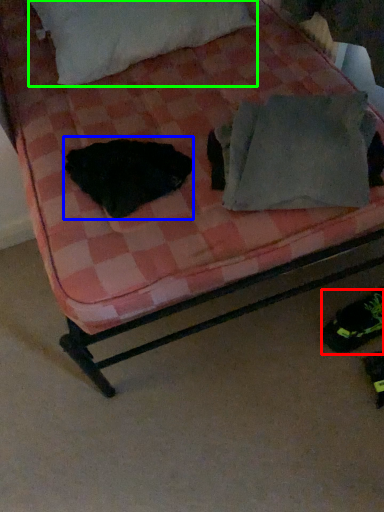
Question: Based on their relative distances, which object is nearer to footwear (highlighted by a red box)? Choose from animal (highlighted by a blue box) and pillow (highlighted by a green box).

Choices:
 (A) animal
 (B) pillow

Answer: (A)